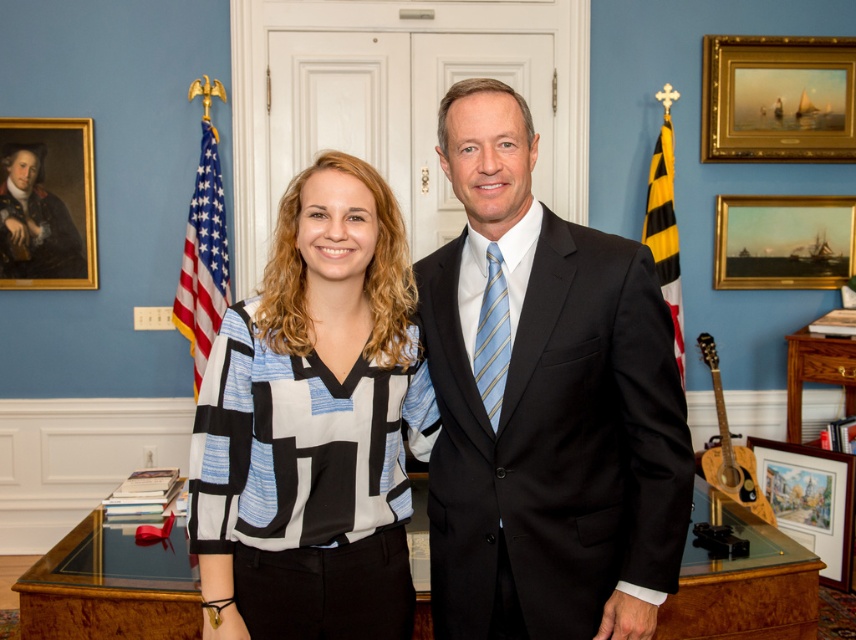
You are an interior designer observing the office scene. You notice the black wool suit at center and the matte black and white blouse at center. Which clothing item is positioned to the right side of the other?

The black wool suit at center is to the right of the matte black and white blouse at center.

You are standing in an office and want to reach the gold framed painting at upper right. The office has a 3.5 meter clearance between the entrance and the wall where the painting is hung. Can you walk straight to the painting without any obstacles?

The gold framed painting at upper right is 4.11 meters away from the viewer. Since the office only has a 3.5 meter clearance between the entrance and the wall, you cannot reach the painting by walking straight as the distance is greater than the available space.